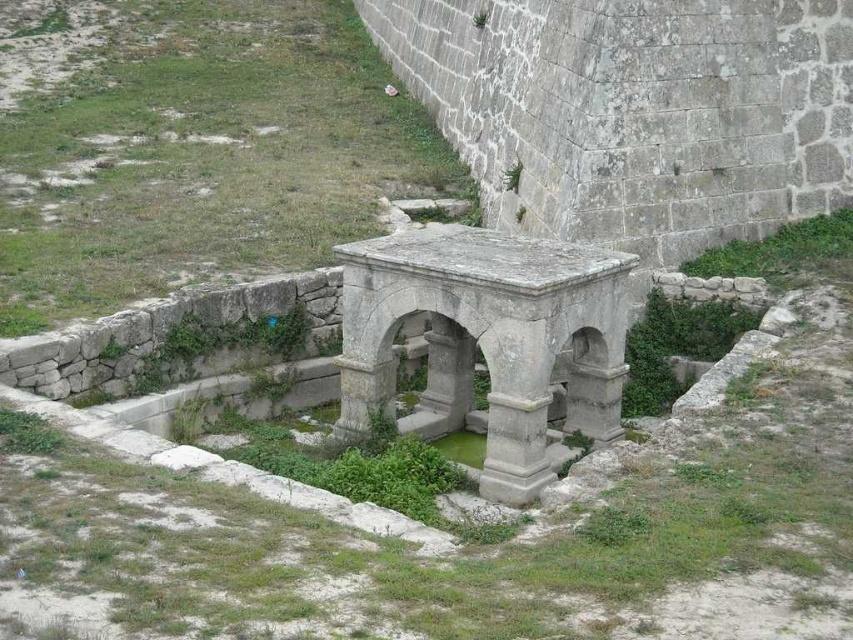
Can you confirm if gray stone fountain at center is positioned to the left of gray stone column at center?

Correct, you'll find gray stone fountain at center to the left of gray stone column at center.

Which is behind, point (519, 381) or point (479, 484)?

The point (479, 484) is behind.

Where is `gray stone fountain at center`? gray stone fountain at center is located at coordinates (486, 340).